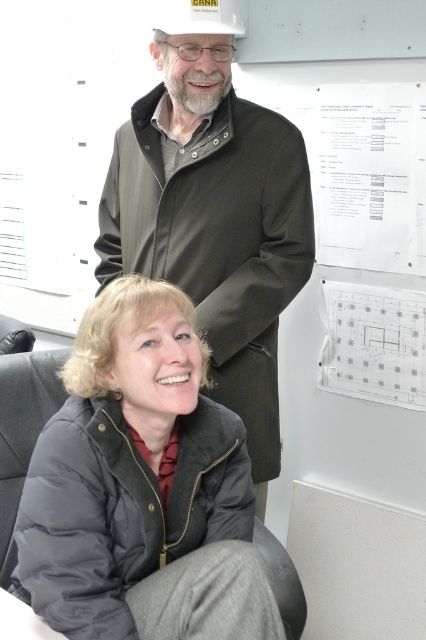
Question: Which point is farther to the camera?

Choices:
 (A) green matte coat at center
 (B) white matte hat at upper center
 (C) transparent plastic poster at upper right

Answer: (C)

Question: Can you confirm if dark gray puffer jacket at lower left is positioned to the left of white matte hat at upper center?

Choices:
 (A) no
 (B) yes

Answer: (B)

Question: Among these points, which one is nearest to the camera?

Choices:
 (A) (393, 310)
 (B) (91, 544)
 (C) (114, 148)

Answer: (B)

Question: Which is farther from the white matte hat at upper center?

Choices:
 (A) transparent plastic poster at upper right
 (B) dark gray puffer jacket at lower left

Answer: (A)

Question: Does dark gray puffer jacket at lower left have a smaller size compared to white matte hat at upper center?

Choices:
 (A) yes
 (B) no

Answer: (B)

Question: Is green matte coat at center in front of white matte hat at upper center?

Choices:
 (A) yes
 (B) no

Answer: (B)